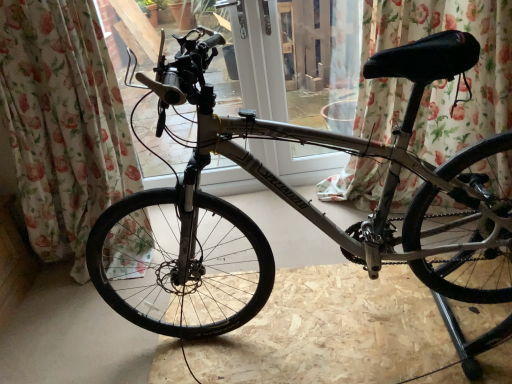
Question: Does floral fabric curtain at left, the first curtain viewed from the left, touch floral fabric curtain at upper center, which appears as the 1th curtain when viewed from the right?

Choices:
 (A) yes
 (B) no

Answer: (B)

Question: Is floral fabric curtain at left, positioned as the second curtain in right-to-left order, closer to camera compared to floral fabric curtain at upper center, which appears as the 1th curtain when viewed from the right?

Choices:
 (A) no
 (B) yes

Answer: (B)

Question: Is floral fabric curtain at left, positioned as the second curtain in right-to-left order, thinner than floral fabric curtain at upper center, which appears as the 1th curtain when viewed from the right?

Choices:
 (A) no
 (B) yes

Answer: (A)

Question: Does floral fabric curtain at left, positioned as the second curtain in right-to-left order, have a lesser height compared to floral fabric curtain at upper center, which appears as the 1th curtain when viewed from the right?

Choices:
 (A) yes
 (B) no

Answer: (B)

Question: From a real-world perspective, does floral fabric curtain at left, the first curtain viewed from the left, sit lower than floral fabric curtain at upper center, the 2th curtain in the left-to-right sequence?

Choices:
 (A) no
 (B) yes

Answer: (A)

Question: Is floral fabric curtain at upper center, which appears as the 1th curtain when viewed from the right, spatially inside silver metallic bicycle at center, or outside of it?

Choices:
 (A) outside
 (B) inside

Answer: (A)

Question: Considering the positions of point (495, 96) and point (245, 168), is point (495, 96) closer or farther from the camera than point (245, 168)?

Choices:
 (A) farther
 (B) closer

Answer: (A)

Question: From a real-world perspective, is floral fabric curtain at upper center, the 2th curtain in the left-to-right sequence, positioned above or below silver metallic bicycle at center?

Choices:
 (A) below
 (B) above

Answer: (B)

Question: Would you say floral fabric curtain at upper center, which appears as the 1th curtain when viewed from the right, is to the left or to the right of silver metallic bicycle at center in the picture?

Choices:
 (A) right
 (B) left

Answer: (A)

Question: Is point (428, 74) positioned closer to the camera than point (52, 33)?

Choices:
 (A) farther
 (B) closer

Answer: (B)

Question: In the image, is silver metallic bicycle at center positioned in front of or behind floral fabric curtain at left, positioned as the second curtain in right-to-left order?

Choices:
 (A) behind
 (B) front

Answer: (B)

Question: Choose the correct answer: Is silver metallic bicycle at center inside floral fabric curtain at left, the first curtain viewed from the left, or outside it?

Choices:
 (A) outside
 (B) inside

Answer: (A)

Question: Would you say silver metallic bicycle at center is to the left or to the right of floral fabric curtain at left, the first curtain viewed from the left, in the picture?

Choices:
 (A) left
 (B) right

Answer: (B)

Question: From a real-world perspective, is floral fabric curtain at left, the first curtain viewed from the left, positioned above or below floral fabric curtain at upper center, which appears as the 1th curtain when viewed from the right?

Choices:
 (A) below
 (B) above

Answer: (B)

Question: From the image's perspective, relative to floral fabric curtain at upper center, the 2th curtain in the left-to-right sequence, is floral fabric curtain at left, positioned as the second curtain in right-to-left order, above or below?

Choices:
 (A) above
 (B) below

Answer: (B)